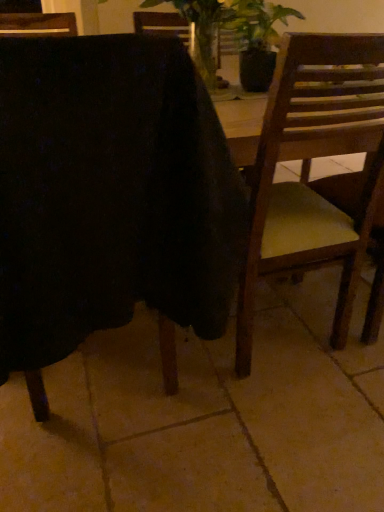
Question: Should I look upward or downward to see wooden chair at right, which appears as the 1th chair when viewed from the right?

Choices:
 (A) up
 (B) down

Answer: (A)

Question: From a real-world perspective, is wooden chair at right, which appears as the second chair when viewed from the left, beneath wooden chair at center, the 2th chair when ordered from right to left?

Choices:
 (A) yes
 (B) no

Answer: (A)

Question: Does wooden chair at right, which appears as the 1th chair when viewed from the right, have a smaller size compared to wooden chair at center, the 2th chair when ordered from right to left?

Choices:
 (A) yes
 (B) no

Answer: (A)

Question: Is wooden chair at right, which appears as the 1th chair when viewed from the right, wider than wooden chair at center, the 2th chair when ordered from right to left?

Choices:
 (A) yes
 (B) no

Answer: (B)

Question: From the image's perspective, is wooden chair at right, which appears as the second chair when viewed from the left, below wooden chair at center, the 1th chair from the left?

Choices:
 (A) no
 (B) yes

Answer: (B)

Question: Is wooden chair at right, which appears as the second chair when viewed from the left, bigger than wooden chair at center, the 1th chair from the left?

Choices:
 (A) yes
 (B) no

Answer: (B)

Question: Is wooden chair at right, which appears as the second chair when viewed from the left, thinner than wooden chair at center, the 2th chair when ordered from right to left?

Choices:
 (A) yes
 (B) no

Answer: (A)

Question: Would you say wooden chair at right, which appears as the 1th chair when viewed from the right, is part of wooden chair at center, the 1th chair from the left,'s contents?

Choices:
 (A) yes
 (B) no

Answer: (B)

Question: Is wooden chair at center, the 2th chair when ordered from right to left, turned away from wooden chair at right, which appears as the 1th chair when viewed from the right?

Choices:
 (A) no
 (B) yes

Answer: (A)

Question: Is wooden chair at center, the 2th chair when ordered from right to left, to the left of wooden chair at right, which appears as the 1th chair when viewed from the right, from the viewer's perspective?

Choices:
 (A) no
 (B) yes

Answer: (B)

Question: Is wooden chair at center, the 1th chair from the left, at the right side of wooden chair at right, which appears as the second chair when viewed from the left?

Choices:
 (A) no
 (B) yes

Answer: (A)

Question: Can you confirm if wooden chair at center, the 1th chair from the left, is wider than wooden chair at right, which appears as the second chair when viewed from the left?

Choices:
 (A) yes
 (B) no

Answer: (A)

Question: Does wooden chair at center, the 2th chair when ordered from right to left, have a lesser width compared to wooden chair at right, which appears as the 1th chair when viewed from the right?

Choices:
 (A) no
 (B) yes

Answer: (A)

Question: Visually, is wooden chair at center, the 2th chair when ordered from right to left, positioned to the left or to the right of wooden chair at right, which appears as the second chair when viewed from the left?

Choices:
 (A) left
 (B) right

Answer: (A)